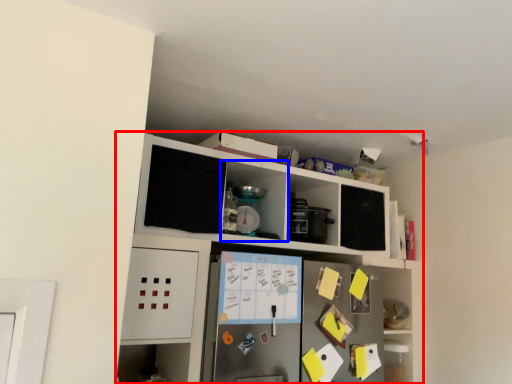
Question: Which of the following is the farthest to the observer, cabinetry (highlighted by a red box) or cabinet (highlighted by a blue box)?

Choices:
 (A) cabinetry
 (B) cabinet

Answer: (B)